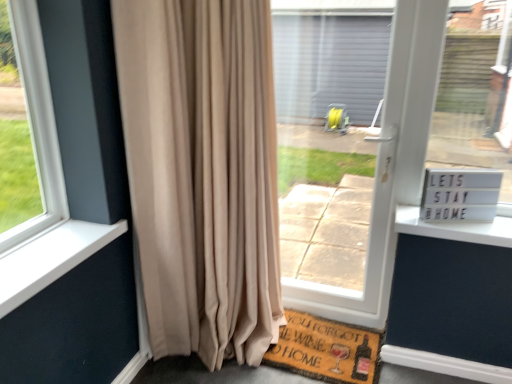
Question: Is brown mat at lower center with white plastic sign at right?

Choices:
 (A) yes
 (B) no

Answer: (B)

Question: Does brown mat at lower center lie behind white plastic sign at right?

Choices:
 (A) no
 (B) yes

Answer: (A)

Question: Is brown mat at lower center aimed at white plastic sign at right?

Choices:
 (A) no
 (B) yes

Answer: (A)

Question: Does brown mat at lower center appear on the left side of white plastic sign at right?

Choices:
 (A) no
 (B) yes

Answer: (B)

Question: From a real-world perspective, is brown mat at lower center on white plastic sign at right?

Choices:
 (A) no
 (B) yes

Answer: (A)

Question: Considering the relative sizes of brown mat at lower center and white plastic sign at right in the image provided, is brown mat at lower center smaller than white plastic sign at right?

Choices:
 (A) yes
 (B) no

Answer: (B)

Question: Is beige velvet curtain at left not within brown mat at lower center?

Choices:
 (A) yes
 (B) no

Answer: (A)

Question: From the image's perspective, is beige velvet curtain at left on brown mat at lower center?

Choices:
 (A) no
 (B) yes

Answer: (B)

Question: From a real-world perspective, is beige velvet curtain at left located beneath brown mat at lower center?

Choices:
 (A) yes
 (B) no

Answer: (B)

Question: Can you confirm if beige velvet curtain at left is positioned to the right of brown mat at lower center?

Choices:
 (A) no
 (B) yes

Answer: (A)

Question: Would you say beige velvet curtain at left contains brown mat at lower center?

Choices:
 (A) yes
 (B) no

Answer: (B)

Question: Does beige velvet curtain at left appear on the left side of brown mat at lower center?

Choices:
 (A) no
 (B) yes

Answer: (B)

Question: Could brown woven mat at lower center be considered to be inside brown mat at lower center?

Choices:
 (A) yes
 (B) no

Answer: (A)